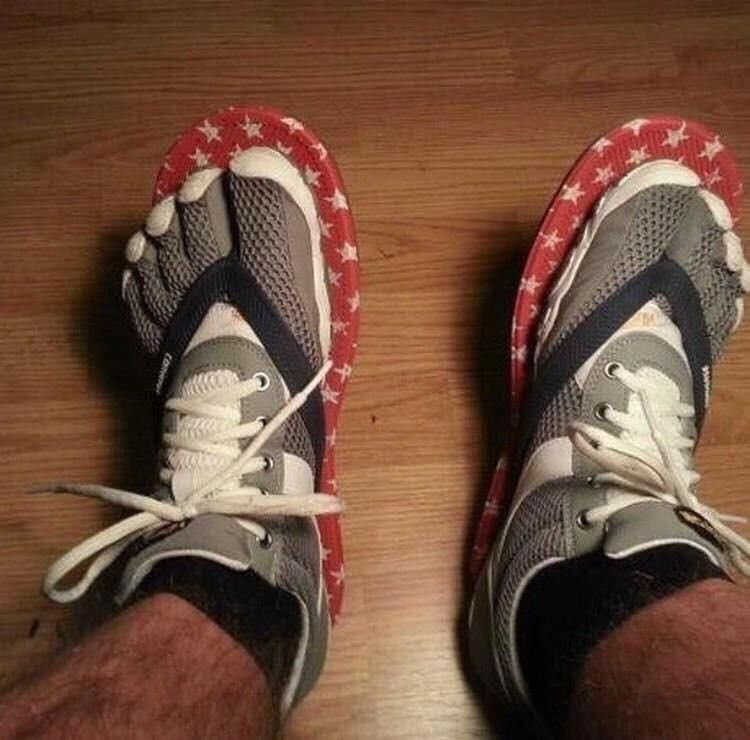
This screenshot has height=740, width=750. Identify the location of shadow on floor. (495, 351).